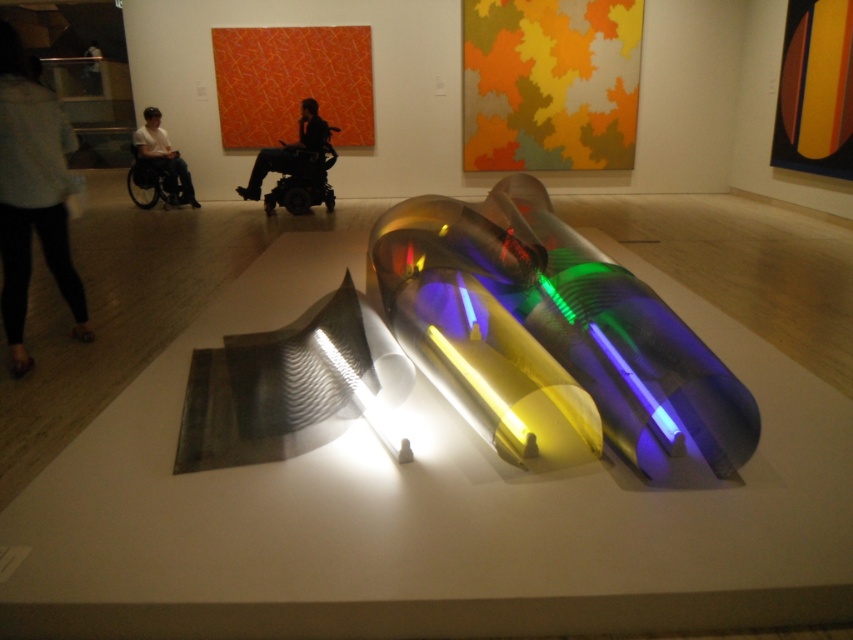
Is black matte wheelchair at center thinner than matte black wheelchair at left?

Incorrect, black matte wheelchair at center's width is not less than matte black wheelchair at left's.

Can you confirm if black matte wheelchair at center is positioned to the left of matte black wheelchair at left?

In fact, black matte wheelchair at center is to the right of matte black wheelchair at left.

Which is in front, point (318, 129) or point (144, 141)?

Point (318, 129)

Locate an element on the screen. black matte wheelchair at center is located at coordinates (292, 152).

Find the location of a particular element. The image size is (853, 640). light gray fabric pants at left is located at coordinates (32, 195).

Between light gray fabric pants at left and black matte wheelchair at center, which one appears on the right side from the viewer's perspective?

black matte wheelchair at center

Find the location of a particular element. The width and height of the screenshot is (853, 640). light gray fabric pants at left is located at coordinates (32, 195).

Is the position of light gray fabric pants at left less distant than that of matte black wheelchair at left?

Yes, light gray fabric pants at left is in front of matte black wheelchair at left.

Does point (56, 170) lie behind point (144, 115)?

No, it is not.

What do you see at coordinates (32, 195) in the screenshot?
I see `light gray fabric pants at left` at bounding box center [32, 195].

This screenshot has width=853, height=640. Identify the location of light gray fabric pants at left. (32, 195).